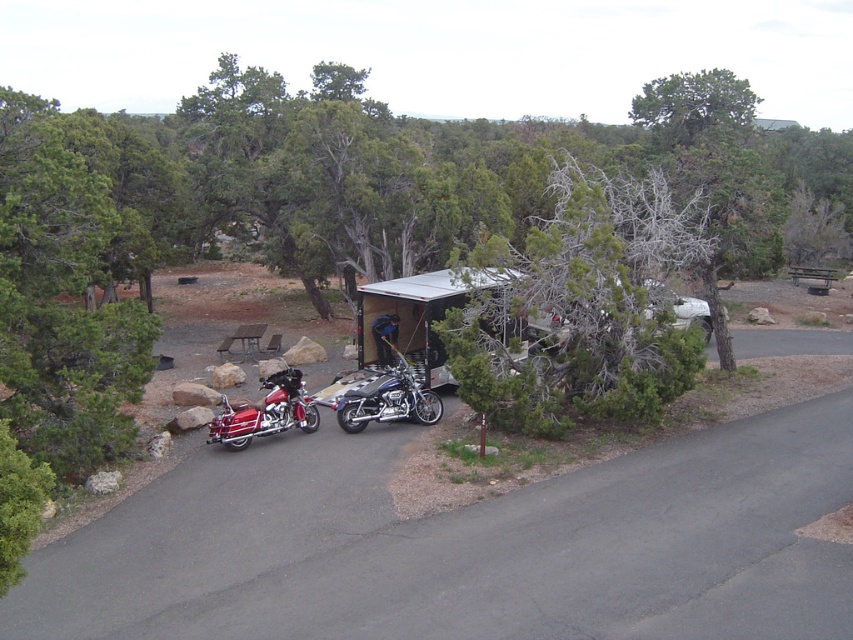
Which is more to the right, shiny blue chrome motorcycle at center or brown wooden picnic table at center?

From the viewer's perspective, shiny blue chrome motorcycle at center appears more on the right side.

Does shiny blue chrome motorcycle at center have a greater width compared to brown wooden picnic table at center?

Correct, the width of shiny blue chrome motorcycle at center exceeds that of brown wooden picnic table at center.

This screenshot has width=853, height=640. Describe the element at coordinates (387, 400) in the screenshot. I see `shiny blue chrome motorcycle at center` at that location.

Locate an element on the screen. Image resolution: width=853 pixels, height=640 pixels. shiny blue chrome motorcycle at center is located at coordinates (387, 400).

Which of these two, green textured tree at center or shiny blue chrome motorcycle at center, stands shorter?

green textured tree at center is shorter.

Is the position of green textured tree at center less distant than that of shiny blue chrome motorcycle at center?

Yes.

The width and height of the screenshot is (853, 640). What are the coordinates of `green textured tree at center` in the screenshot? It's located at (579, 308).

This screenshot has width=853, height=640. Identify the location of green textured tree at center. (579, 308).

Between green textured tree at center and brown wooden picnic table at center, which one has less height?

Standing shorter between the two is brown wooden picnic table at center.

Is green textured tree at center positioned in front of brown wooden picnic table at center?

Yes, green textured tree at center is closer to the viewer.

Is point (659, 332) more distant than point (224, 352)?

No, it is in front of (224, 352).

Find the location of a particular element. green textured tree at center is located at coordinates (579, 308).